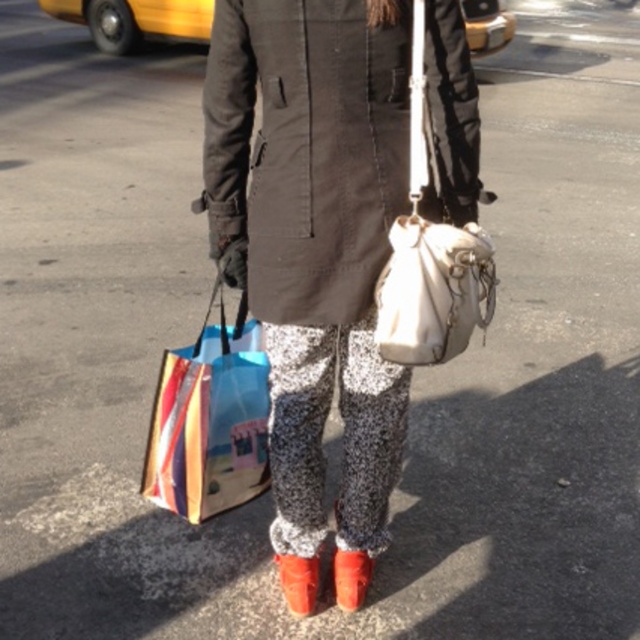
You are a delivery person who needs to place a package at the exact coordinates of the colorful paper bag at lower left. According to the image, what are the coordinates where you should place the package?

The coordinates for the colorful paper bag at lower left are at point (209, 420), so you should place the package there.